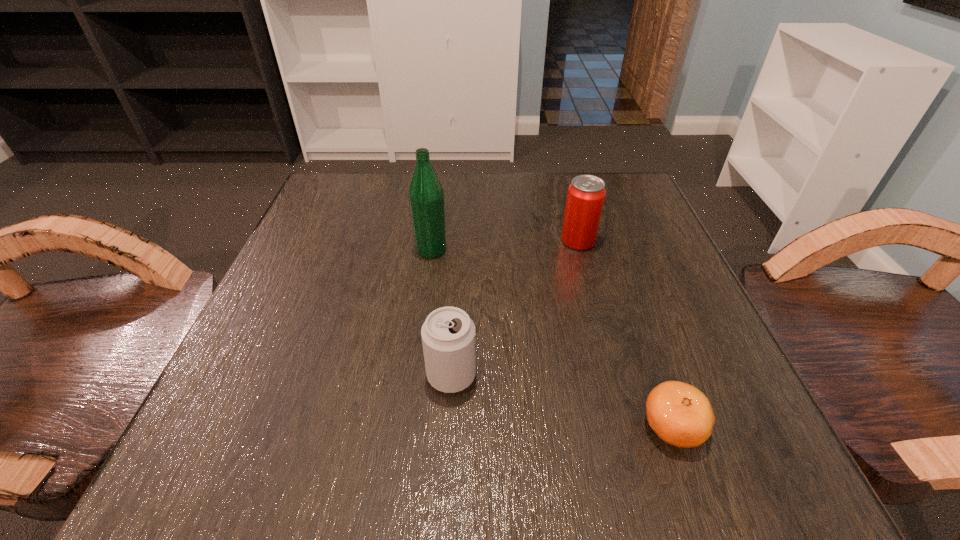
You are a GUI agent. You are given a task and a screenshot of the screen. Output one action in this format:
    pyautogui.click(x=<x>, y=<y>)
    Task: Click on the object at the far edge
    The width and height of the screenshot is (960, 540).
    Given the screenshot: What is the action you would take?
    pyautogui.click(x=585, y=198)

The image size is (960, 540). I want to click on object present at the near edge, so click(681, 415).

Locate an element on the screen. Image resolution: width=960 pixels, height=540 pixels. can that is positioned at the right edge is located at coordinates (585, 198).

The width and height of the screenshot is (960, 540). In order to click on clementine positioned at the right edge in this screenshot , I will do `click(681, 415)`.

Identify the location of object that is at the far right corner. (585, 198).

Locate an element on the screen. object at the near right corner is located at coordinates (681, 415).

In the image, there is a desktop. In order to click on vacant space at the far edge in this screenshot , I will do `click(486, 179)`.

Image resolution: width=960 pixels, height=540 pixels. In order to click on vacant area at the left edge in this screenshot , I will do `click(305, 345)`.

Where is `vacant space at the right edge`? vacant space at the right edge is located at coordinates (641, 259).

Identify the location of free space at the far left corner of the desktop. The image size is (960, 540). (349, 215).